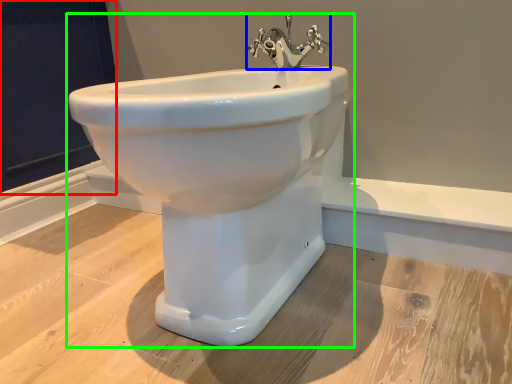
Question: Considering the real-world distances, which object is farthest from screen door (highlighted by a red box)? tap (highlighted by a blue box) or sink (highlighted by a green box)?

Choices:
 (A) tap
 (B) sink

Answer: (B)